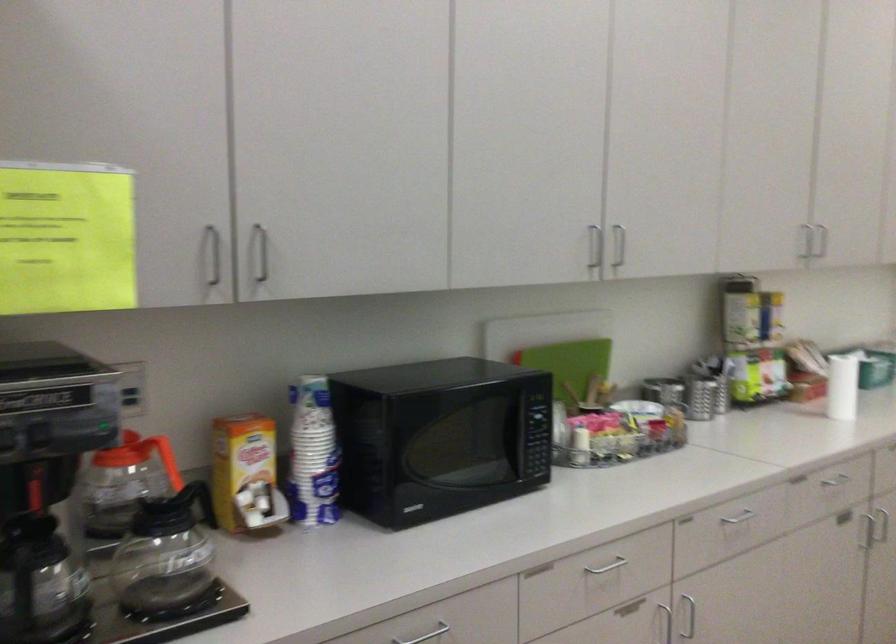
You are a GUI agent. You are given a task and a screenshot of the screen. Output one action in this format:
    pyautogui.click(x=<x>, y=<y>)
    Task: Click on the metal utensil holder
    The height and width of the screenshot is (644, 896).
    Given the screenshot: What is the action you would take?
    pyautogui.click(x=159, y=619)